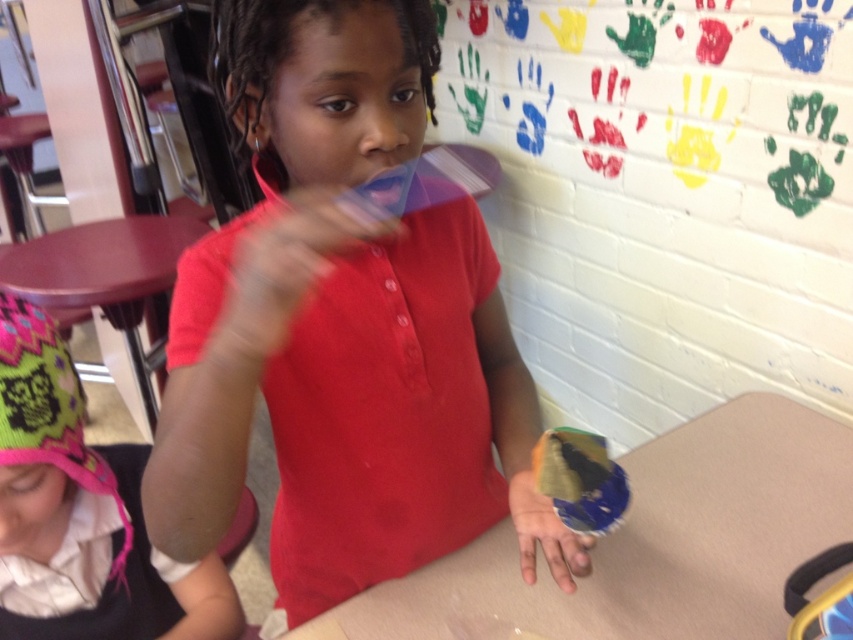
Question: Which object appears closest to the camera in this image?

Choices:
 (A) matte plastic comb at center
 (B) smooth beige table at center
 (C) smooth plastic hand at center

Answer: (A)

Question: Which of the following is the closest to the observer?

Choices:
 (A) smooth brown table at lower left
 (B) matte plastic comb at center

Answer: (B)

Question: Based on their relative distances, which object is nearer to the matte plastic comb at center?

Choices:
 (A) smooth beige table at center
 (B) smooth brown table at lower left

Answer: (A)

Question: Can you confirm if matte plastic comb at center is bigger than smooth brown table at lower left?

Choices:
 (A) yes
 (B) no

Answer: (B)

Question: Is matte plastic comb at center bigger than translucent plastic cup at center?

Choices:
 (A) yes
 (B) no

Answer: (A)

Question: Does matte plastic comb at center have a greater width compared to smooth plastic hand at center?

Choices:
 (A) yes
 (B) no

Answer: (A)